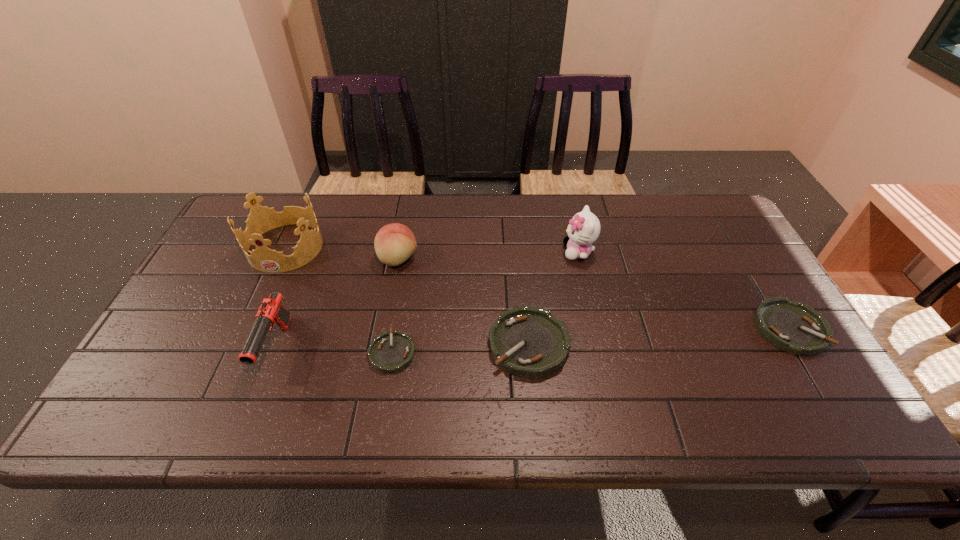
Where is `the leftmost ashtray`? Image resolution: width=960 pixels, height=540 pixels. the leftmost ashtray is located at coordinates point(390,352).

Where is `the shortest object`? This screenshot has width=960, height=540. the shortest object is located at coordinates (390, 352).

The height and width of the screenshot is (540, 960). I want to click on the second ashtray from right to left, so click(526, 341).

Find the location of a particular element. the rightmost ashtray is located at coordinates (795, 327).

I want to click on the rightmost object, so click(x=795, y=327).

At what (x,y) coordinates should I click in order to perform the action: click on tiara. Please return your answer as a coordinate pair (x, y). This screenshot has height=540, width=960. Looking at the image, I should click on (261, 219).

At what (x,y) coordinates should I click in order to perform the action: click on the second object from right to left. Please return your answer as a coordinate pair (x, y). This screenshot has width=960, height=540. Looking at the image, I should click on (584, 228).

Find the location of `peach`. peach is located at coordinates tap(394, 243).

Find the location of `gun`. gun is located at coordinates (271, 311).

The image size is (960, 540). Find the location of `vacant space situated on the back of the shortest ashtray`. vacant space situated on the back of the shortest ashtray is located at coordinates (405, 275).